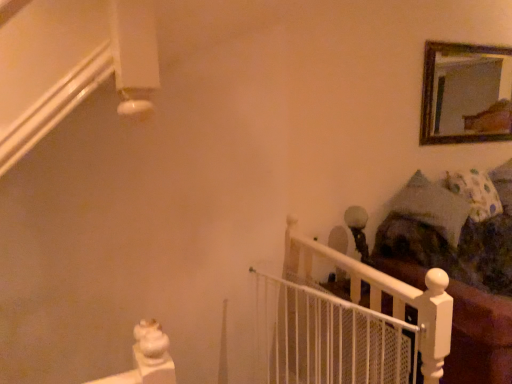
Question: Is point (501, 59) closer or farther from the camera than point (466, 200)?

Choices:
 (A) closer
 (B) farther

Answer: (B)

Question: Would you say wooden-framed mirror at upper right is to the left or to the right of fluffy white pillow at right in the picture?

Choices:
 (A) right
 (B) left

Answer: (B)

Question: Which is farther from the dark brown fabric bed at right?

Choices:
 (A) fluffy white pillow at right
 (B) white mesh gate at center
 (C) wooden-framed mirror at upper right

Answer: (C)

Question: Estimate the real-world distances between objects in this image. Which object is farther from the fluffy white pillow at right?

Choices:
 (A) dark brown fabric bed at right
 (B) wooden-framed mirror at upper right
 (C) white mesh gate at center

Answer: (B)